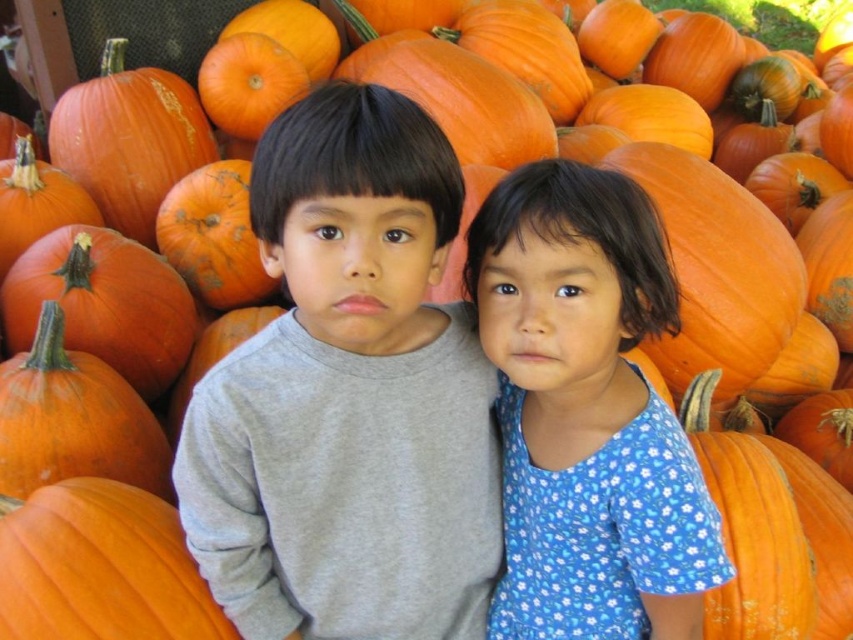
You are a photographer trying to capture a clear shot of the gray cotton shirt at center. The camera is positioned at the origin point. Which direction should you move the camera to get the shirt into the frame?

The gray cotton shirt at center is located at point 0.619 on the x and 0.409 on the y. Since the camera is at the origin, you should move the camera to the right and slightly upwards to center the shirt in the frame.

You are a photographer trying to capture a photo of both the gray cotton shirt at center and the blue floral dress at center. Since you want to ensure both are fully visible in the frame, which clothing item has a larger width and might require more space in the composition?

The gray cotton shirt at center has a larger width than the blue floral dress at center, so it requires more space in the composition to ensure it is fully visible.